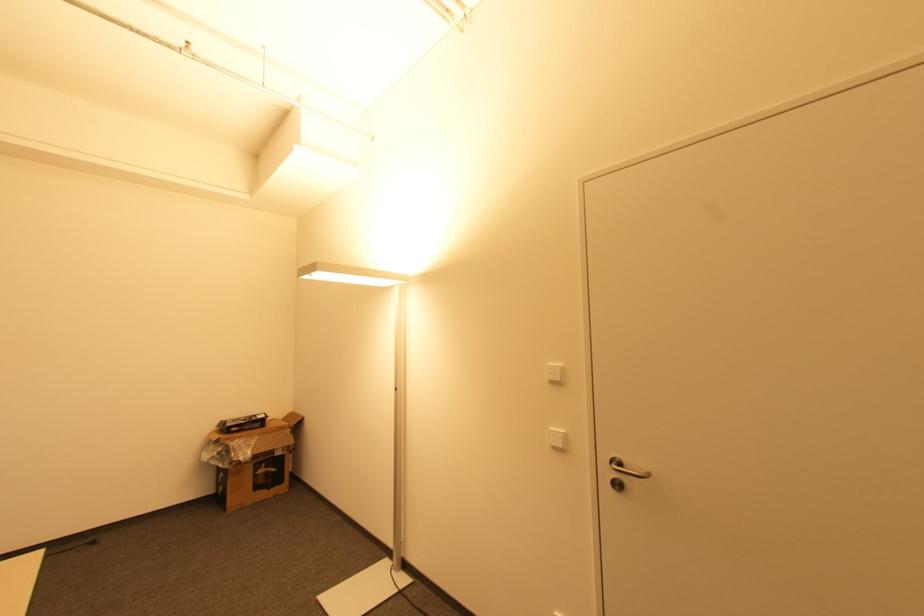
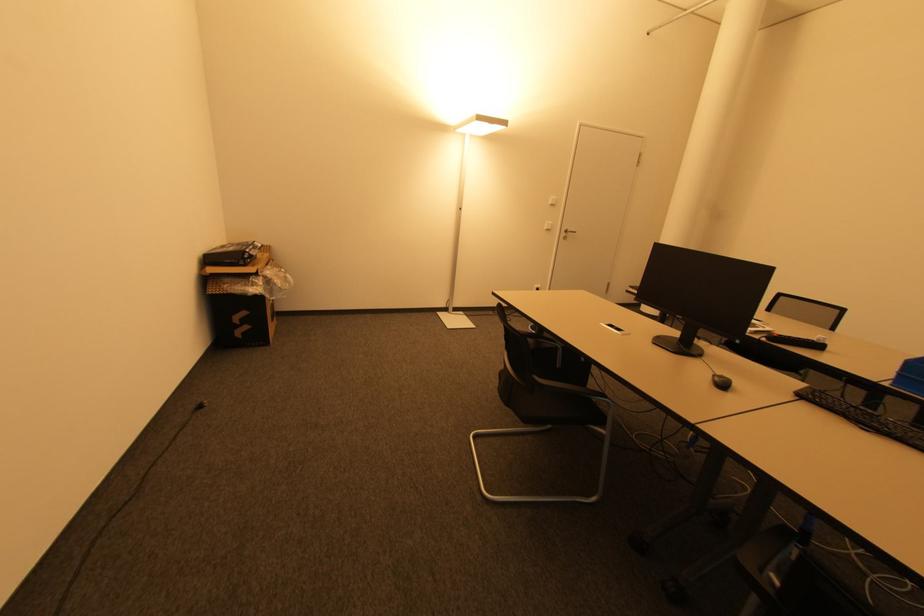
The point at (93, 543) is marked in the first image. Where is the corresponding point in the second image?

(201, 408)